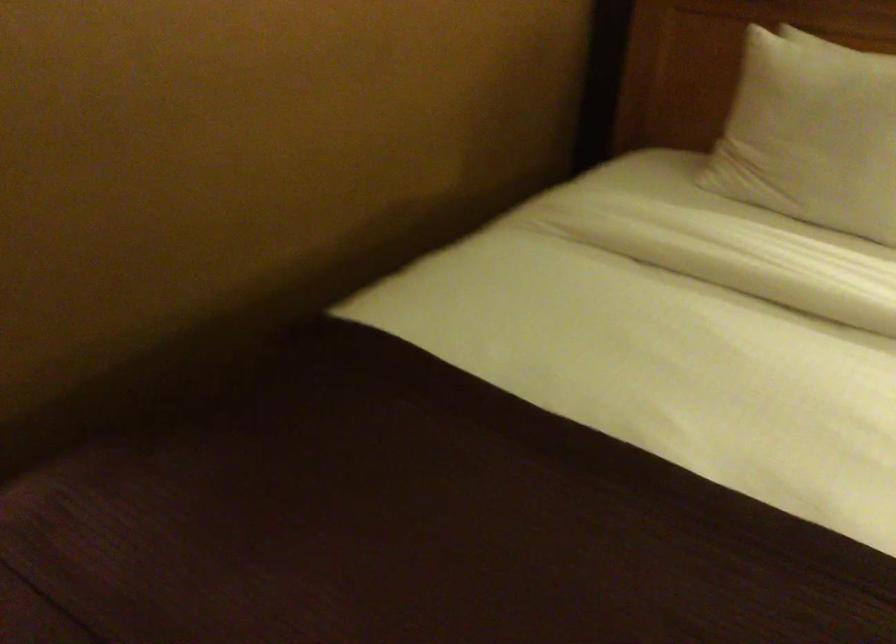
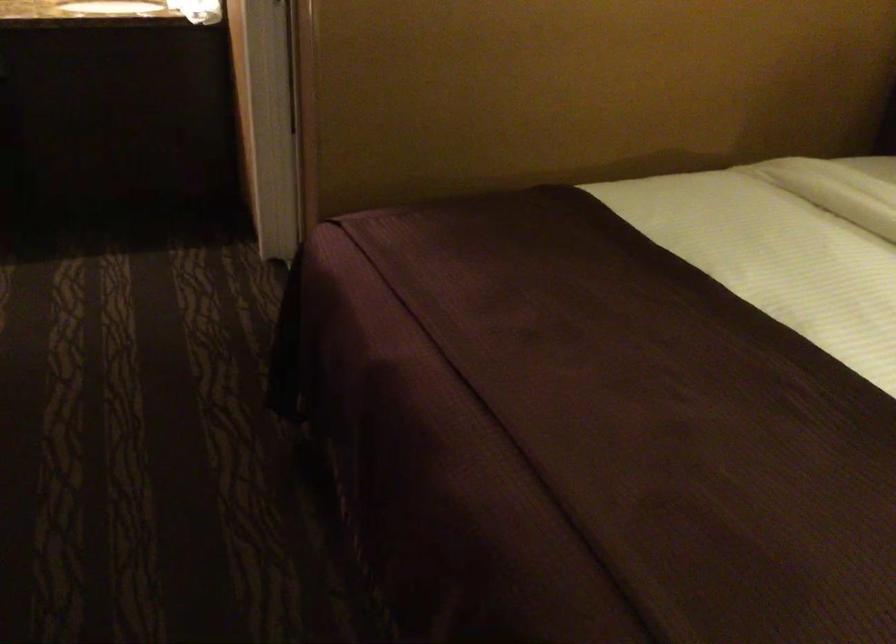
Question: Based on the continuous images, in which direction is the camera rotating? Reply with the corresponding letter.

Choices:
 (A) Left
 (B) Right
 (C) Up
 (D) Down

Answer: (A)